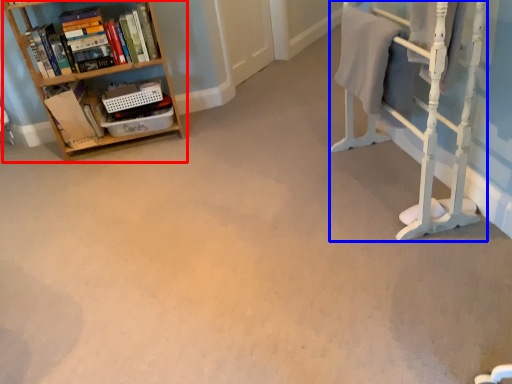
Question: Among these objects, which one is farthest to the camera, shelf (highlighted by a red box) or bunk bed (highlighted by a blue box)?

Choices:
 (A) shelf
 (B) bunk bed

Answer: (A)